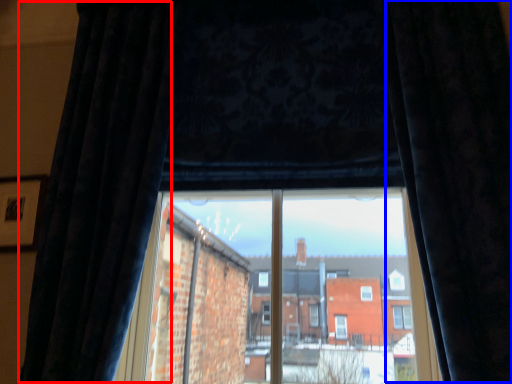
Question: Among these objects, which one is farthest to the camera, curtain (highlighted by a red box) or curtain (highlighted by a blue box)?

Choices:
 (A) curtain
 (B) curtain

Answer: (A)